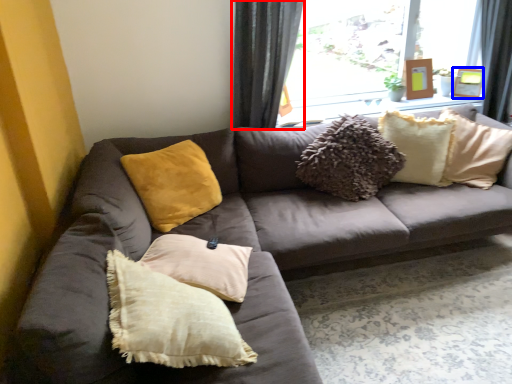
Question: Which object is further to the camera taking this photo, curtain (highlighted by a red box) or picture frame (highlighted by a blue box)?

Choices:
 (A) curtain
 (B) picture frame

Answer: (B)